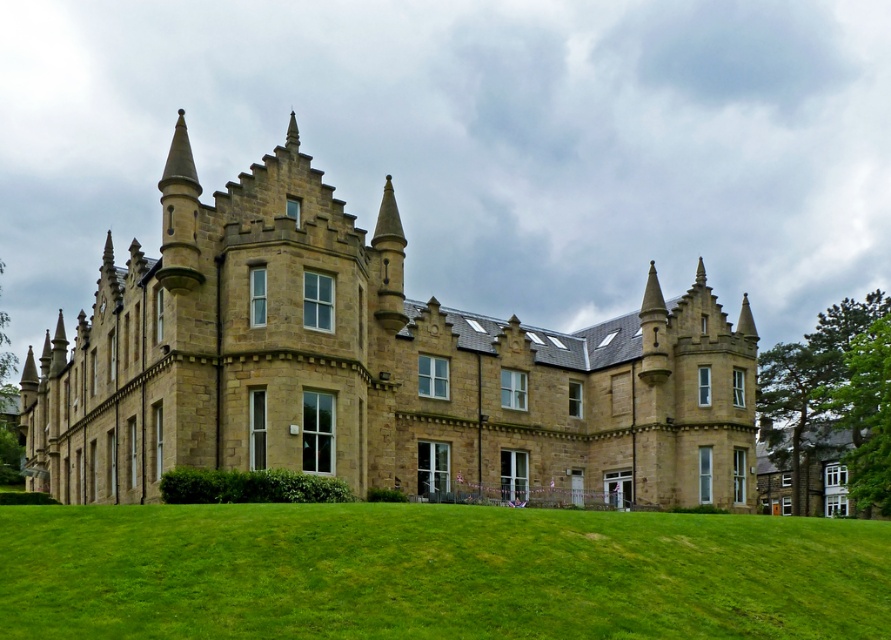
Does brown stone castle at center come behind green grassy field at lower center?

Yes.

Does brown stone castle at center appear on the left side of green grassy field at lower center?

Yes, brown stone castle at center is to the left of green grassy field at lower center.

This screenshot has height=640, width=891. What are the coordinates of `brown stone castle at center` in the screenshot? It's located at pos(372,368).